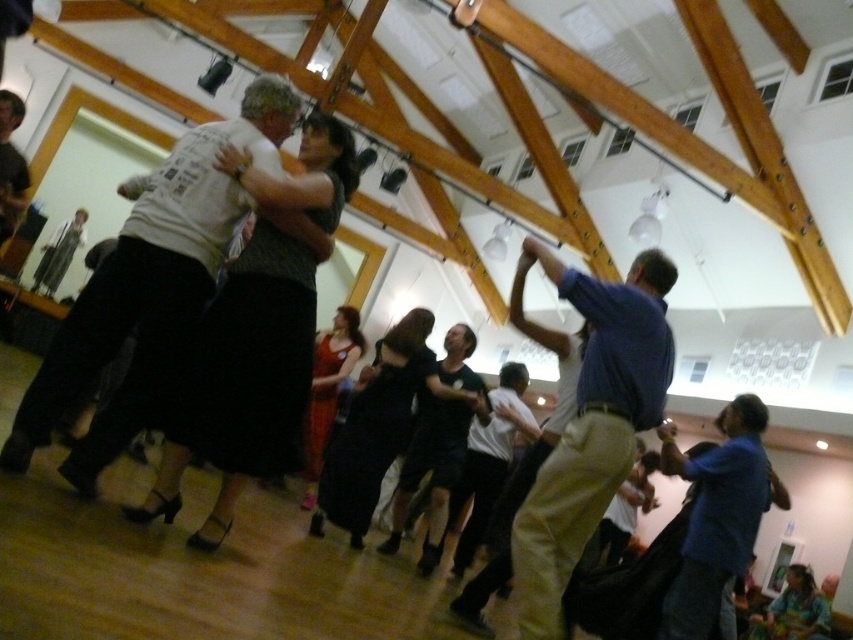
Question: Does dark gray cotton shirt at upper left have a lesser width compared to khaki pants at center?

Choices:
 (A) no
 (B) yes

Answer: (A)

Question: Which object is farther from the camera taking this photo?

Choices:
 (A) dark gray cotton shirt at upper left
 (B) blue fabric shirt at lower right
 (C) khaki pants at center

Answer: (B)

Question: Which point is farther to the camera?

Choices:
 (A) khaki pants at center
 (B) dark gray cotton shirt at upper left
 (C) blue fabric shirt at lower right

Answer: (C)

Question: Is dark gray cotton shirt at upper left positioned at the back of blue fabric shirt at lower right?

Choices:
 (A) yes
 (B) no

Answer: (B)

Question: Is khaki pants at center below blue fabric shirt at lower right?

Choices:
 (A) no
 (B) yes

Answer: (A)

Question: Estimate the real-world distances between objects in this image. Which object is closer to the dark gray cotton shirt at upper left?

Choices:
 (A) khaki pants at center
 (B) blue fabric shirt at lower right

Answer: (A)